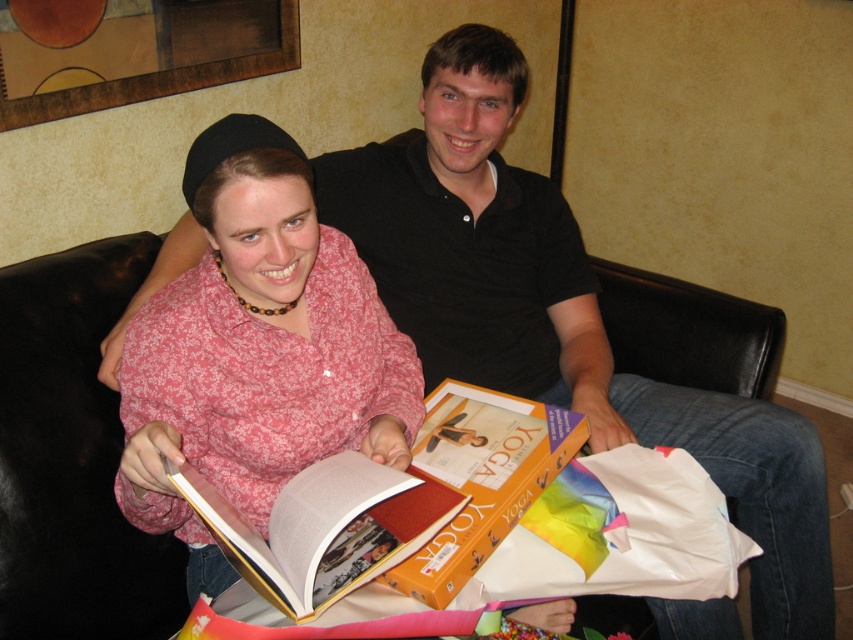
You are a photographer taking a picture of the scene. You want to ensure both the pink floral shirt at center and the hardcover book at center are clearly visible in the frame. Which object should you focus on first to ensure proper alignment?

The pink floral shirt at center is to the left of the hardcover book at center, so you should focus on the pink floral shirt at center first to ensure proper alignment.